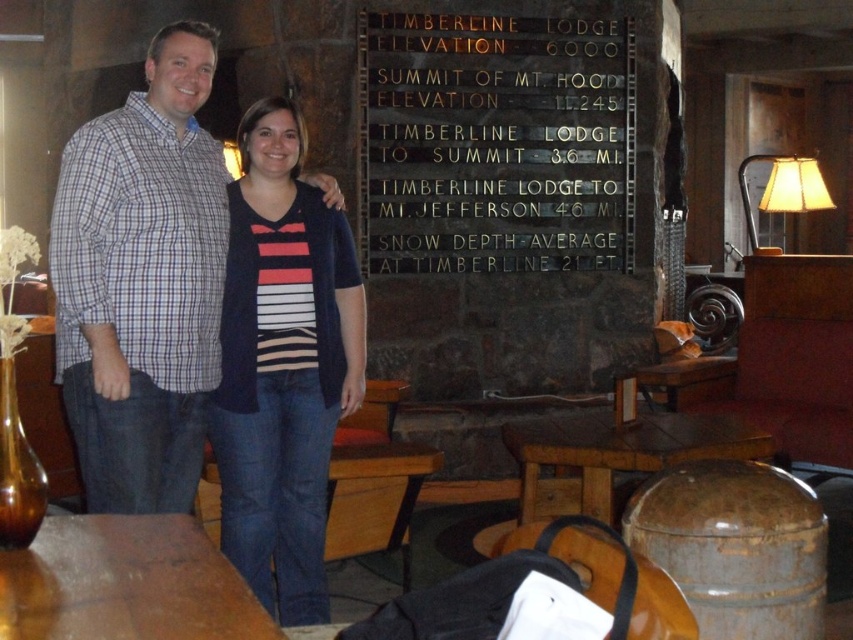
Question: Is plaid cotton shirt at center closer to camera compared to striped knit sweater at center?

Choices:
 (A) no
 (B) yes

Answer: (B)

Question: Based on their relative distances, which object is farther from the rustic wood table at lower center?

Choices:
 (A) striped knit sweater at center
 (B) wooden table at lower center

Answer: (A)

Question: Considering the relative positions of plaid cotton shirt at center and striped knit sweater at center in the image provided, where is plaid cotton shirt at center located with respect to striped knit sweater at center?

Choices:
 (A) above
 (B) below

Answer: (A)

Question: Which object is closer to the camera taking this photo?

Choices:
 (A) plaid cotton shirt at center
 (B) rustic wood table at lower center
 (C) striped knit sweater at center
 (D) brown wooden table at lower left

Answer: (D)

Question: Considering the real-world distances, which object is closest to the wooden table at lower center?

Choices:
 (A) brown wooden table at lower left
 (B) striped knit sweater at center
 (C) plaid cotton shirt at center

Answer: (B)

Question: Does striped knit sweater at center appear under wooden table at lower center?

Choices:
 (A) no
 (B) yes

Answer: (A)